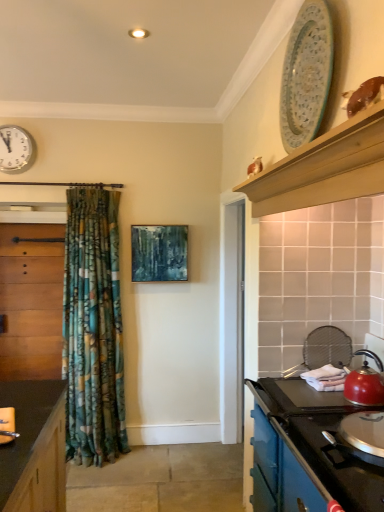
Find the location of a particular element. This screenshot has height=512, width=384. vacant area on top of blue enamel stove at lower right, the first cabinetry positioned from the front (from a real-world perspective) is located at coordinates (323, 414).